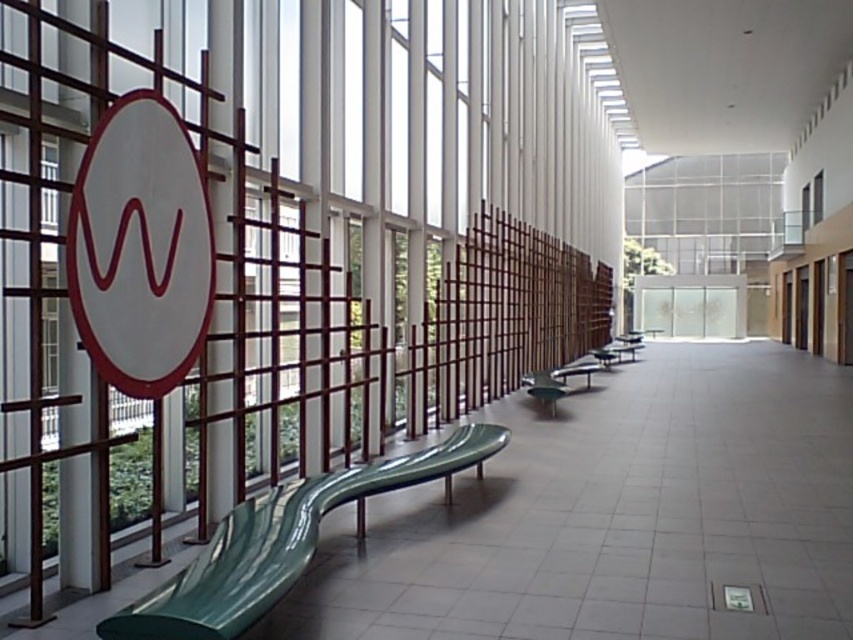
Question: Does green glossy bench at lower left have a smaller size compared to green glossy bench at center?

Choices:
 (A) yes
 (B) no

Answer: (B)

Question: Where is green glossy bench at lower left located in relation to clear glass window at upper left in the image?

Choices:
 (A) right
 (B) left

Answer: (A)

Question: Which object appears closest to the camera in this image?

Choices:
 (A) clear glass window at upper left
 (B) green glossy bench at center
 (C) white matte sign at upper left
 (D) green glossy bench at lower left

Answer: (D)

Question: Among these objects, which one is farthest from the camera?

Choices:
 (A) white matte sign at upper left
 (B) green glossy bench at center

Answer: (B)

Question: Does green glossy bench at lower left have a larger size compared to green glossy bench at center?

Choices:
 (A) yes
 (B) no

Answer: (A)

Question: Which point is closer to the camera?

Choices:
 (A) green glossy bench at lower left
 (B) green glossy bench at center
 (C) clear glass window at upper left

Answer: (A)